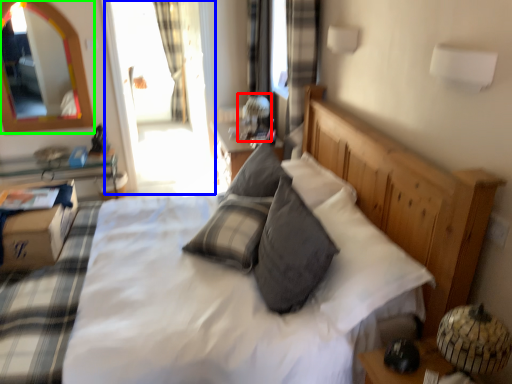
Question: Considering the real-world distances, which object is closest to table lamp (highlighted by a red box)? glass door (highlighted by a blue box) or mirror (highlighted by a green box).

Choices:
 (A) glass door
 (B) mirror

Answer: (A)